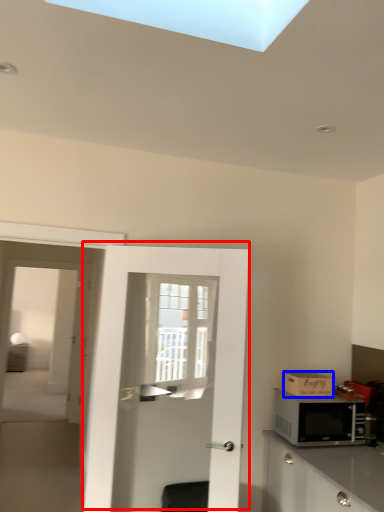
Question: Which object appears closest to the camera in this image, door (highlighted by a red box) or cardboard box (highlighted by a blue box)?

Choices:
 (A) door
 (B) cardboard box

Answer: (A)